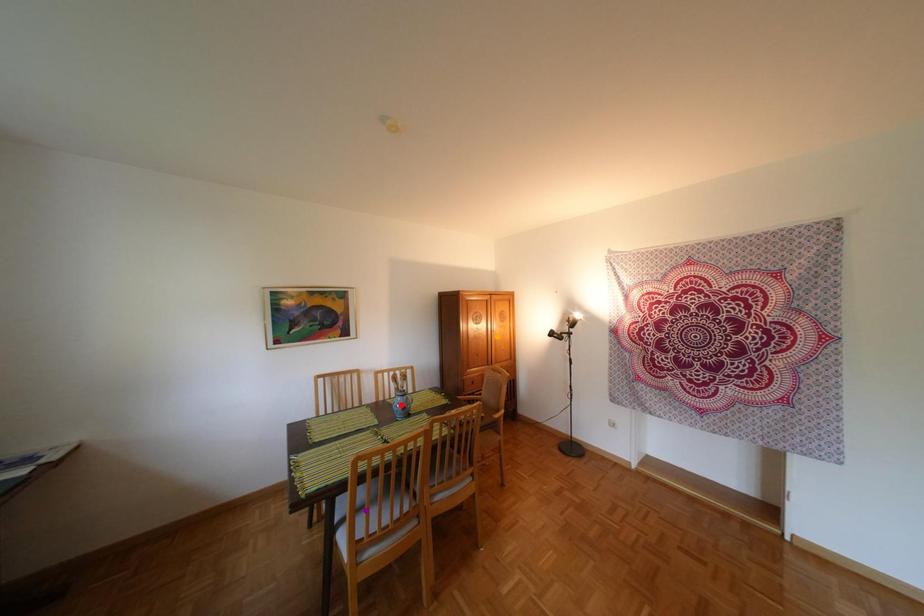
Order these from nearest to farthest:
orange point, purple point, red point

orange point → red point → purple point